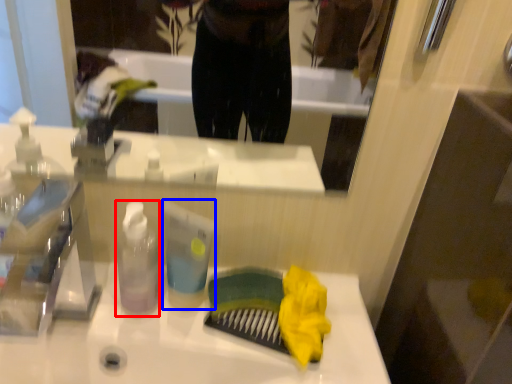
Question: Which object is closer to the camera taking this photo, bottle (highlighted by a red box) or toiletry (highlighted by a blue box)?

Choices:
 (A) bottle
 (B) toiletry

Answer: (A)